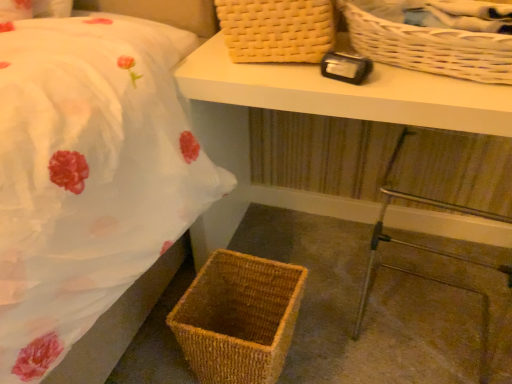
Question: Is metallic silver step stool at lower right taller than brown woven picnic basket at lower left, the 1th picnic basket ordered from the bottom?

Choices:
 (A) no
 (B) yes

Answer: (B)

Question: Can you confirm if metallic silver step stool at lower right is positioned to the right of brown woven picnic basket at lower left, the 3th picnic basket positioned from the top?

Choices:
 (A) yes
 (B) no

Answer: (A)

Question: Is metallic silver step stool at lower right outside brown woven picnic basket at lower left, the 3th picnic basket positioned from the top?

Choices:
 (A) yes
 (B) no

Answer: (A)

Question: Is brown woven picnic basket at lower left, the 1th picnic basket ordered from the bottom, at the back of metallic silver step stool at lower right?

Choices:
 (A) no
 (B) yes

Answer: (A)

Question: Does metallic silver step stool at lower right have a lesser width compared to brown woven picnic basket at lower left, the 3th picnic basket positioned from the top?

Choices:
 (A) no
 (B) yes

Answer: (A)

Question: Looking at their shapes, would you say brown woven picnic basket at lower left, the 1th picnic basket ordered from the bottom, is wider or thinner than white wicker picnic basket at upper right, which appears as the second picnic basket when ordered from the bottom?

Choices:
 (A) thin
 (B) wide

Answer: (A)

Question: Considering the positions of point (281, 370) and point (357, 39), is point (281, 370) closer or farther from the camera than point (357, 39)?

Choices:
 (A) farther
 (B) closer

Answer: (A)

Question: From the image's perspective, is brown woven picnic basket at lower left, the 3th picnic basket positioned from the top, positioned above or below white wicker picnic basket at upper right, which appears as the second picnic basket when ordered from the bottom?

Choices:
 (A) above
 (B) below

Answer: (B)

Question: Which is correct: brown woven picnic basket at lower left, the 3th picnic basket positioned from the top, is inside white wicker picnic basket at upper right, which is counted as the second picnic basket, starting from the top, or outside of it?

Choices:
 (A) inside
 (B) outside

Answer: (B)

Question: Does point (243, 29) appear closer or farther from the camera than point (483, 382)?

Choices:
 (A) closer
 (B) farther

Answer: (A)

Question: From a real-world perspective, is woven beige picnic basket at upper center, arranged as the first picnic basket when viewed from the top, positioned above or below metallic silver step stool at lower right?

Choices:
 (A) below
 (B) above

Answer: (B)

Question: Relative to metallic silver step stool at lower right, is woven beige picnic basket at upper center, arranged as the first picnic basket when viewed from the top, in front or behind?

Choices:
 (A) behind
 (B) front

Answer: (A)

Question: Is woven beige picnic basket at upper center, arranged as the first picnic basket when viewed from the top, to the left or to the right of metallic silver step stool at lower right in the image?

Choices:
 (A) right
 (B) left

Answer: (B)

Question: In the image, is brown woven picnic basket at lower left, the 3th picnic basket positioned from the top, on the left side or the right side of woven wicker basket at lower left?

Choices:
 (A) left
 (B) right

Answer: (A)

Question: Is brown woven picnic basket at lower left, the 3th picnic basket positioned from the top, bigger or smaller than woven wicker basket at lower left?

Choices:
 (A) small
 (B) big

Answer: (A)